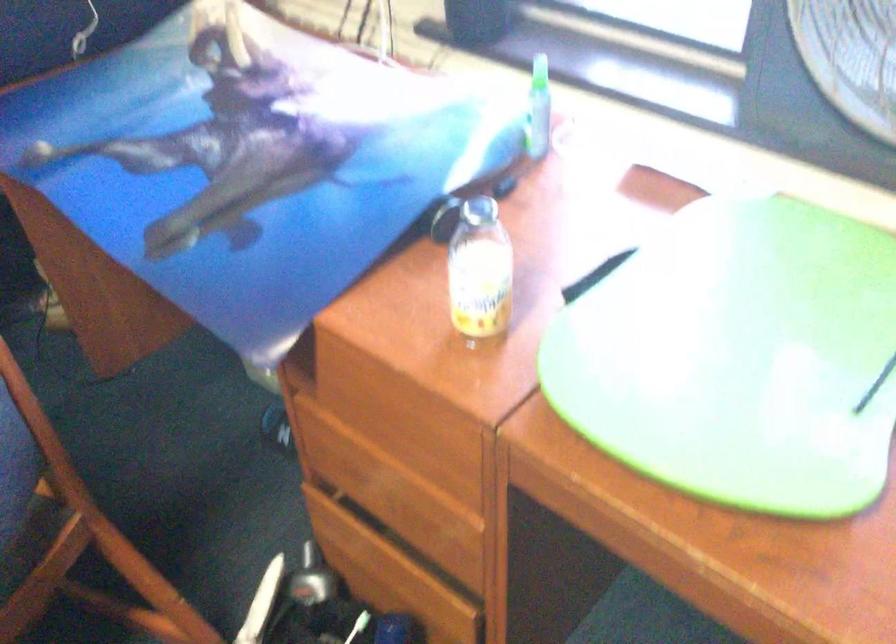
Find the location of `silver bottle cap`. silver bottle cap is located at coordinates (311, 579).